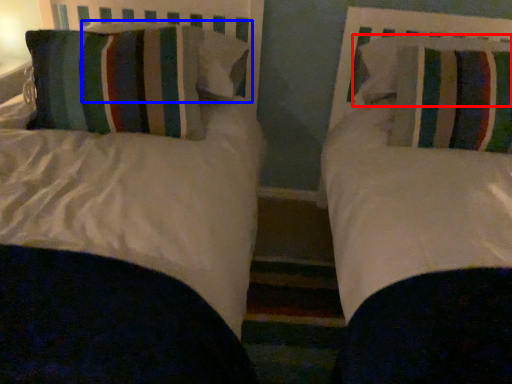
Question: Which point is closer to the camera, pillow (highlighted by a red box) or pillow (highlighted by a blue box)?

Choices:
 (A) pillow
 (B) pillow

Answer: (A)